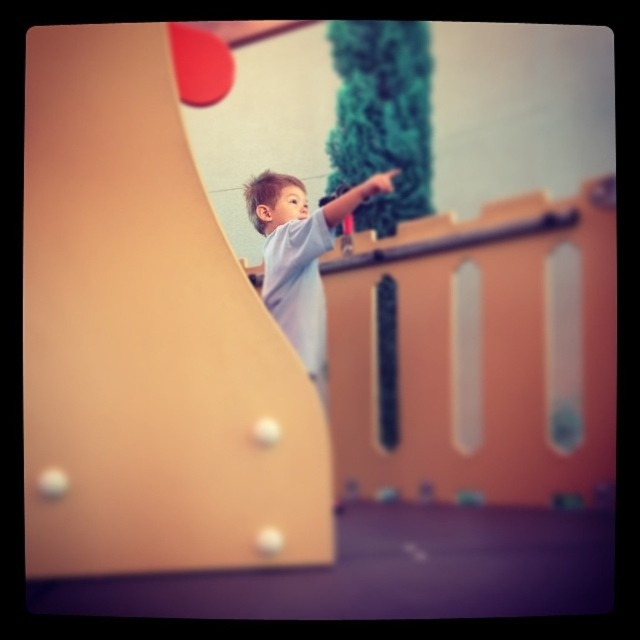
Question: From the image, what is the correct spatial relationship of matte plastic slide at center in relation to light blue t-shirt at center?

Choices:
 (A) below
 (B) above

Answer: (A)

Question: Which point is farther to the camera?

Choices:
 (A) (205, 472)
 (B) (346, 205)

Answer: (A)

Question: Observing the image, what is the correct spatial positioning of matte plastic slide at center in reference to light blue t-shirt at center?

Choices:
 (A) above
 (B) below

Answer: (B)

Question: Which point is closer to the camera taking this photo?

Choices:
 (A) (273, 246)
 (B) (204, 336)

Answer: (A)

Question: Is matte plastic slide at center positioned at the back of light blue t-shirt at center?

Choices:
 (A) yes
 (B) no

Answer: (B)